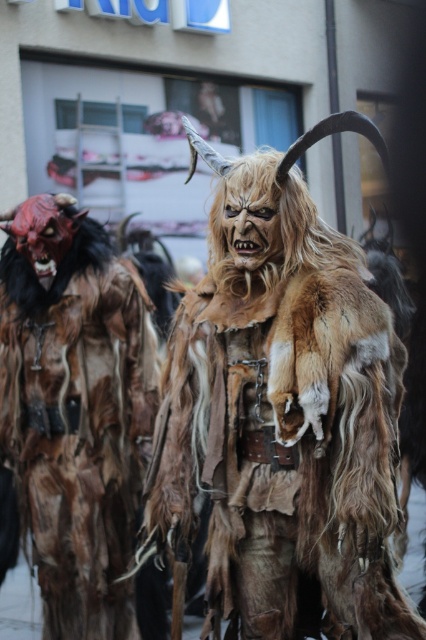
Question: Does furry brown costume at center come behind brown furry costume at left?

Choices:
 (A) no
 (B) yes

Answer: (A)

Question: Does furry brown costume at center appear under brown furry costume at left?

Choices:
 (A) yes
 (B) no

Answer: (B)

Question: Is furry brown costume at center closer to the viewer compared to brown furry costume at left?

Choices:
 (A) yes
 (B) no

Answer: (A)

Question: Which object is farther from the camera taking this photo?

Choices:
 (A) furry brown costume at center
 (B) brown furry costume at left

Answer: (B)